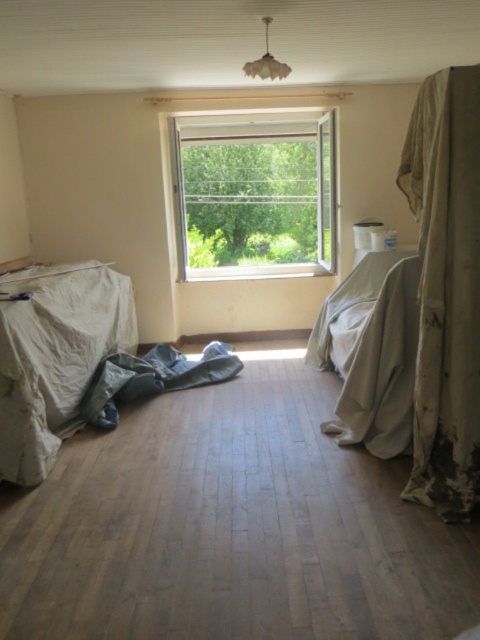
Question: Is clear glass window at center bigger than white fabric bed at center?

Choices:
 (A) yes
 (B) no

Answer: (A)

Question: Does clear glass window at center appear under white fabric bed at center?

Choices:
 (A) no
 (B) yes

Answer: (A)

Question: Which of the following is the farthest from the observer?

Choices:
 (A) (397, 275)
 (B) (429, 182)
 (C) (204, 138)

Answer: (C)

Question: Which of the following is the farthest from the observer?

Choices:
 (A) worn fabric curtain at right
 (B) clear glass window at center
 (C) white fabric bed at center

Answer: (B)

Question: Among these objects, which one is farthest from the camera?

Choices:
 (A) white fabric bed at center
 (B) clear glass window at center

Answer: (B)

Question: Does worn fabric curtain at right come behind white fabric bed at center?

Choices:
 (A) yes
 (B) no

Answer: (B)